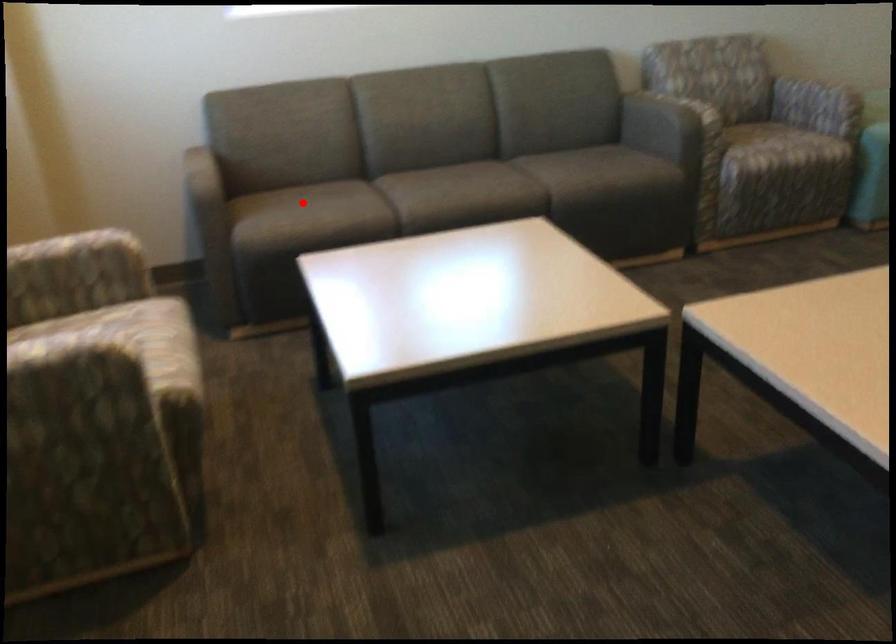
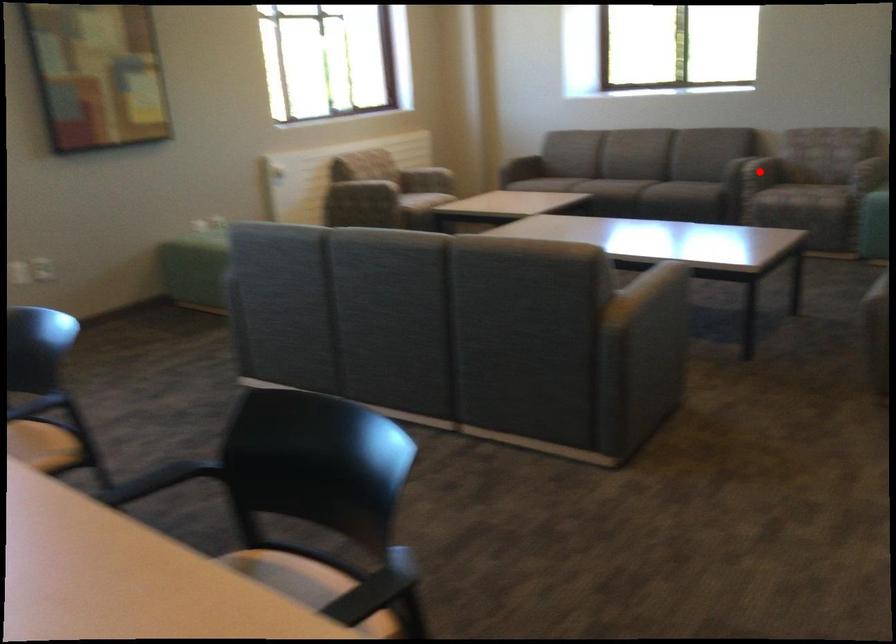
I am providing you with two images of the same scene from different viewpoints. A red point is marked on the first image and another point is marked on the second image. Does the point marked in image1 correspond to the same location as the one in image2?

No